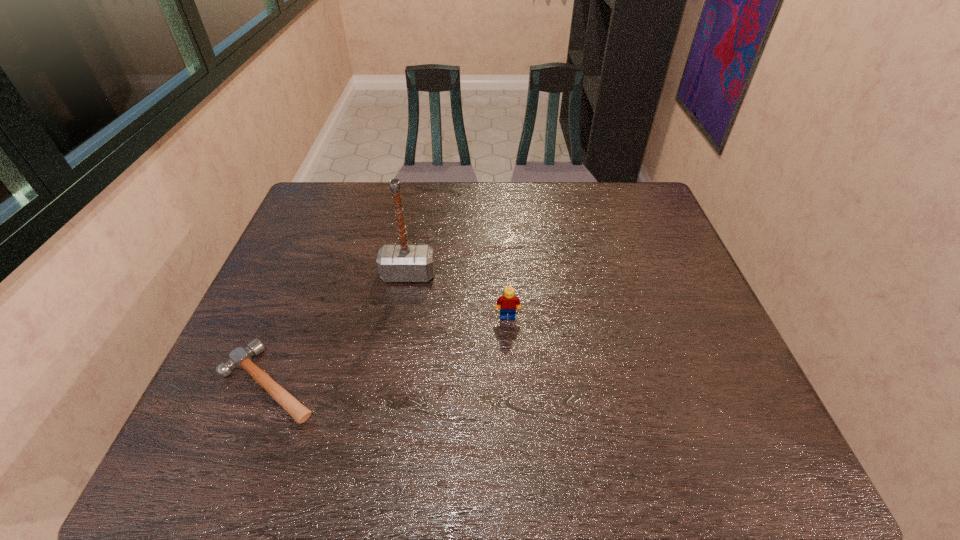
Identify the location of unoccupied area between the farther hammer and the second tallest object. This screenshot has width=960, height=540. (458, 296).

Where is `free spot between the nearest object and the taller hammer`? This screenshot has height=540, width=960. free spot between the nearest object and the taller hammer is located at coordinates (339, 329).

This screenshot has height=540, width=960. What are the coordinates of `empty location between the nearest object and the farther hammer` in the screenshot? It's located at (339, 329).

Identify the location of vacant area that lies between the leftmost object and the right hammer. (339, 329).

Locate an element on the screen. free area in between the second shortest object and the farthest object is located at coordinates (458, 296).

You are a GUI agent. You are given a task and a screenshot of the screen. Output one action in this format:
    pyautogui.click(x=<x>, y=<y>)
    Task: Click on the vacant space in between the second nearest object and the nearest object
    This screenshot has width=960, height=540.
    Given the screenshot: What is the action you would take?
    pyautogui.click(x=389, y=350)

Identify which object is the closest to the second object from left to right. Please provide its 2D coordinates. Your answer should be formatted as a tuple, i.e. [(x, y)], where the tuple contains the x and y coordinates of a point satisfying the conditions above.

[(507, 302)]

I want to click on object that stands as the second closest to the leftmost object, so click(x=507, y=302).